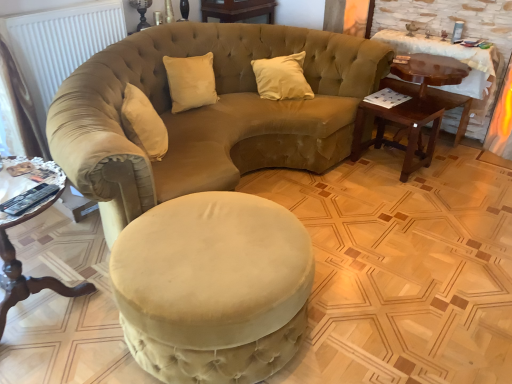
Question: Does mahogany wood side table at right, the third table from the front, have a greater height compared to beige velvet pillow at center?

Choices:
 (A) yes
 (B) no

Answer: (A)

Question: Considering the relative positions of mahogany wood side table at right, which is the 1th table in right-to-left order, and beige velvet pillow at center in the image provided, is mahogany wood side table at right, which is the 1th table in right-to-left order, behind beige velvet pillow at center?

Choices:
 (A) yes
 (B) no

Answer: (A)

Question: Is mahogany wood side table at right, the third table from the front, bigger than beige velvet pillow at center?

Choices:
 (A) no
 (B) yes

Answer: (B)

Question: Does mahogany wood side table at right, which is the 1th table in right-to-left order, touch beige velvet pillow at center?

Choices:
 (A) yes
 (B) no

Answer: (B)

Question: Could beige velvet pillow at center be considered to be inside mahogany wood side table at right, which is the 1th table in right-to-left order?

Choices:
 (A) yes
 (B) no

Answer: (B)

Question: In the image, is mahogany wood side table at right, the third table from the front, on the left side or the right side of velvet beige studio couch at center?

Choices:
 (A) left
 (B) right

Answer: (B)

Question: Is point (477, 135) closer or farther from the camera than point (69, 124)?

Choices:
 (A) farther
 (B) closer

Answer: (A)

Question: Is mahogany wood side table at right, the 1th table positioned from the back, taller or shorter than velvet beige studio couch at center?

Choices:
 (A) short
 (B) tall

Answer: (A)

Question: From a real-world perspective, is mahogany wood side table at right, the third table from the front, positioned above or below velvet beige studio couch at center?

Choices:
 (A) above
 (B) below

Answer: (B)

Question: From their relative heights in the image, would you say mahogany wood side table at right, which is the 1th table in right-to-left order, is taller or shorter than velvet beige ottoman at center?

Choices:
 (A) tall
 (B) short

Answer: (A)

Question: Relative to velvet beige ottoman at center, is mahogany wood side table at right, which is the 1th table in right-to-left order, in front or behind?

Choices:
 (A) front
 (B) behind

Answer: (B)

Question: From a real-world perspective, is mahogany wood side table at right, the 3th table in the left-to-right sequence, positioned above or below velvet beige ottoman at center?

Choices:
 (A) above
 (B) below

Answer: (A)

Question: In terms of width, does mahogany wood side table at right, the 3th table in the left-to-right sequence, look wider or thinner when compared to velvet beige ottoman at center?

Choices:
 (A) wide
 (B) thin

Answer: (B)

Question: Is beige velvet pillow at center wider or thinner than velvet beige studio couch at center?

Choices:
 (A) wide
 (B) thin

Answer: (B)

Question: Considering the positions of point (285, 56) and point (120, 195), is point (285, 56) closer or farther from the camera than point (120, 195)?

Choices:
 (A) closer
 (B) farther

Answer: (B)